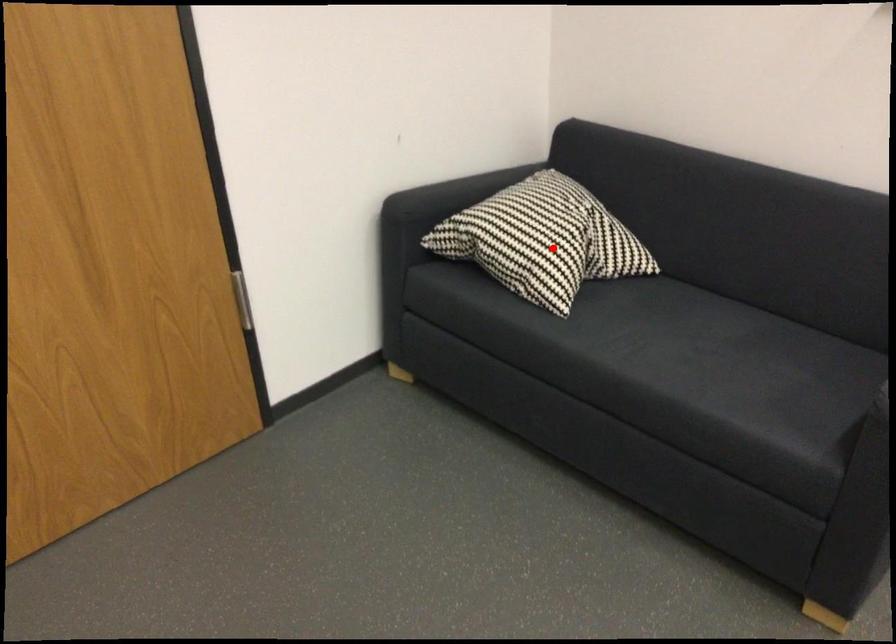
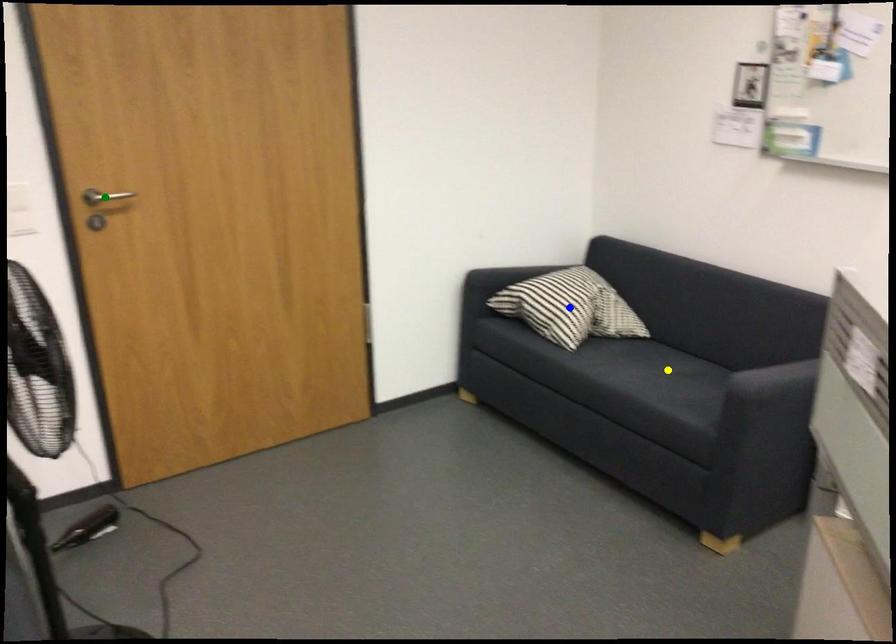
Question: I am providing you with two images of the same scene from different viewpoints. A red point is marked on the first image. You are given multiple points on the second image. In image 2, which mark is for the same physical point as the one in image 1?

Choices:
 (A) yellow point
 (B) green point
 (C) blue point

Answer: (C)